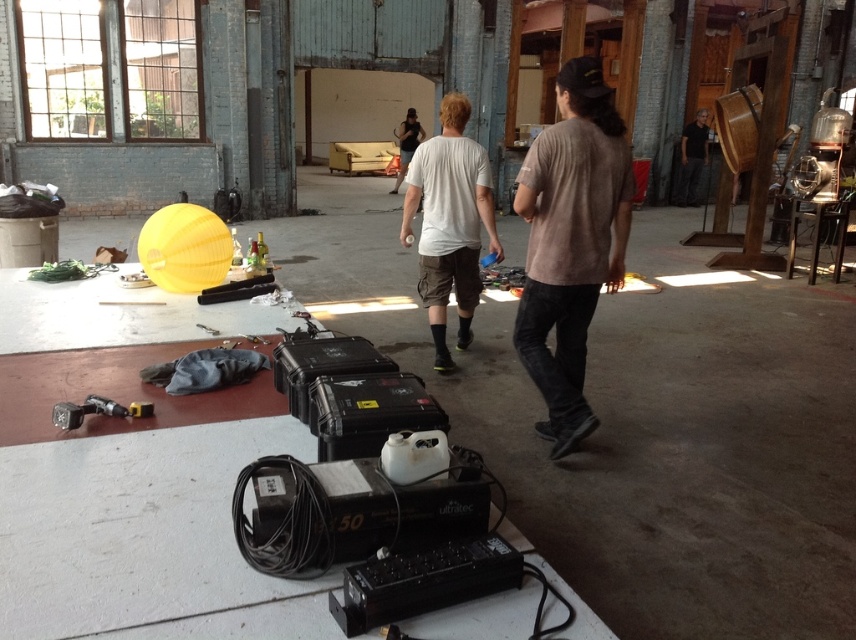
Question: Which of these objects is positioned closest to the dark gray jeans at right?

Choices:
 (A) brown cotton t-shirt at center
 (B) black leather jacket at center

Answer: (B)

Question: Can you confirm if brown cotton t-shirt at center is positioned to the left of black leather jacket at center?

Choices:
 (A) yes
 (B) no

Answer: (B)

Question: Can you confirm if white cotton t-shirt at center is positioned to the right of dark gray jeans at right?

Choices:
 (A) yes
 (B) no

Answer: (B)

Question: Estimate the real-world distances between objects in this image. Which object is closer to the dark gray jeans at right?

Choices:
 (A) black leather jacket at center
 (B) white cotton t-shirt at center

Answer: (A)

Question: Based on their relative distances, which object is farther from the metallic silver drill at lower left?

Choices:
 (A) white cotton t-shirt at center
 (B) dark gray jeans at right

Answer: (B)

Question: Is white cotton t-shirt at center positioned before metallic silver drill at lower left?

Choices:
 (A) yes
 (B) no

Answer: (B)